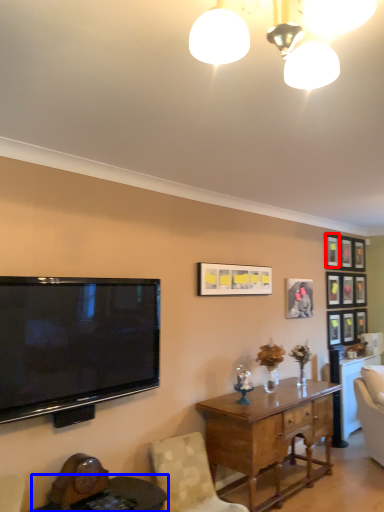
Question: Which object is further to the camera taking this photo, picture frame (highlighted by a red box) or round table (highlighted by a blue box)?

Choices:
 (A) picture frame
 (B) round table

Answer: (A)